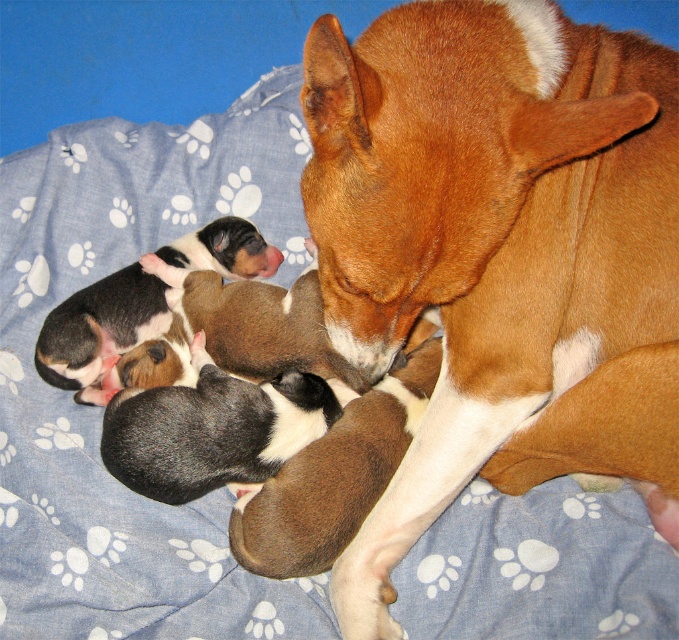
Can you confirm if black and white fur at center is positioned to the left of black and white fur puppies at lower left?

No, black and white fur at center is not to the left of black and white fur puppies at lower left.

Who is more distant from viewer, [234,413] or [113,387]?

The point [113,387] is more distant.

The image size is (679, 640). Find the location of `black and white fur at center`. black and white fur at center is located at coordinates (210, 432).

Is brown smooth dog at center wider than black and white fur puppies at lower left?

Indeed, brown smooth dog at center has a greater width compared to black and white fur puppies at lower left.

Does brown smooth dog at center appear on the left side of black and white fur puppies at lower left?

Incorrect, brown smooth dog at center is not on the left side of black and white fur puppies at lower left.

Is point (623, 204) positioned after point (120, 328)?

No, (623, 204) is closer to viewer.

Locate an element on the screen. brown smooth dog at center is located at coordinates (498, 252).

Does point (380, 177) come farther from viewer compared to point (145, 483)?

No, it is not.

Is brown smooth dog at center wider than black and white fur at center?

Yes.

Measure the distance between point [646,106] and camera.

Point [646,106] is 3.48 feet from camera.

Where is `brown smooth dog at center`? Image resolution: width=679 pixels, height=640 pixels. brown smooth dog at center is located at coordinates click(498, 252).